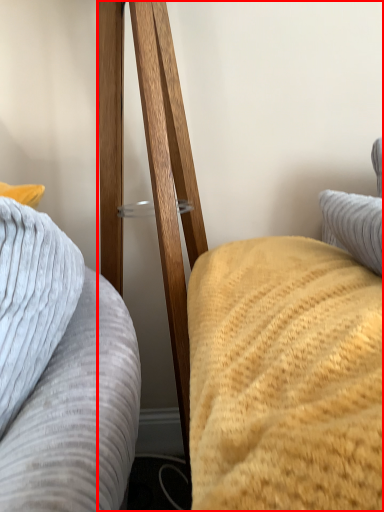
Question: From the image's perspective, considering the relative positions of furniture (annotated by the red box) and furniture in the image provided, where is furniture (annotated by the red box) located with respect to the staircase?

Choices:
 (A) below
 (B) above

Answer: (B)